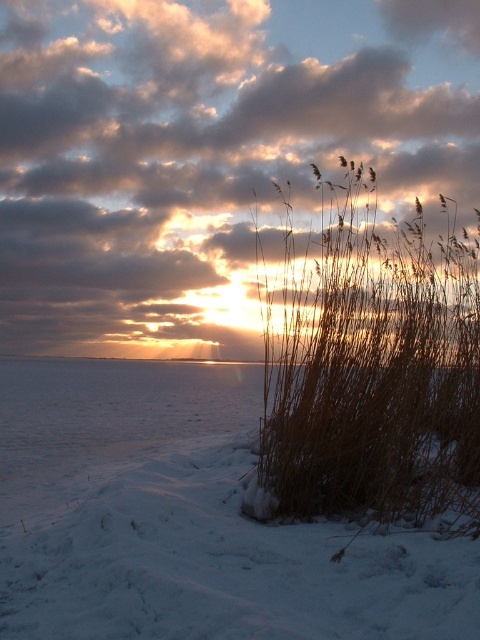
Question: Based on their relative distances, which object is nearer to the dry grass at center?

Choices:
 (A) white fluffy snow at lower left
 (B) cloudy sky at upper center

Answer: (A)

Question: Can you confirm if cloudy sky at upper center is positioned below dry grass at center?

Choices:
 (A) no
 (B) yes

Answer: (A)

Question: Which point is farther to the camera?

Choices:
 (A) white fluffy snow at lower left
 (B) dry grass at center

Answer: (B)

Question: Among these objects, which one is nearest to the camera?

Choices:
 (A) cloudy sky at upper center
 (B) white fluffy snow at lower left
 (C) dry grass at center

Answer: (B)

Question: Can you confirm if cloudy sky at upper center is smaller than white fluffy snow at lower left?

Choices:
 (A) no
 (B) yes

Answer: (A)

Question: Is cloudy sky at upper center positioned at the back of dry grass at center?

Choices:
 (A) yes
 (B) no

Answer: (A)